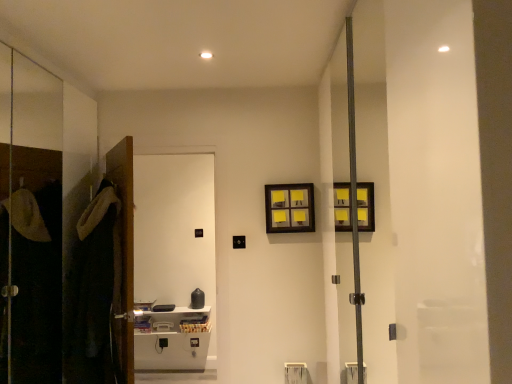
Question: From a real-world perspective, is wooden picture frame at upper center above or below dark brown plush robe at left?

Choices:
 (A) above
 (B) below

Answer: (A)

Question: In the image, is wooden picture frame at upper center on the left side or the right side of dark brown plush robe at left?

Choices:
 (A) right
 (B) left

Answer: (A)

Question: Which object is the closest to the white glossy cabinet at left?

Choices:
 (A) wooden picture frame at upper center
 (B) brown wooden door at left
 (C) dark brown plush robe at left

Answer: (A)

Question: Estimate the real-world distances between objects in this image. Which object is farther from the brown wooden door at left?

Choices:
 (A) dark brown plush robe at left
 (B) white glossy cabinet at left
 (C) wooden picture frame at upper center

Answer: (B)